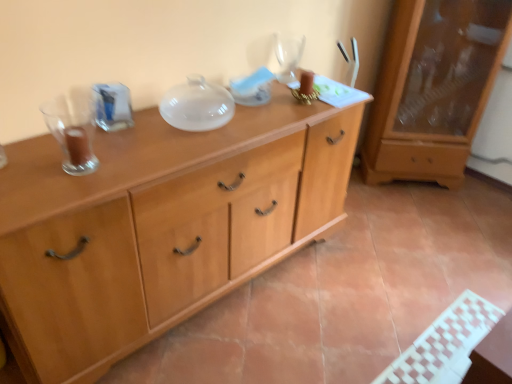
Question: Is light wood cabinet at center a part of transparent glass wine glass at upper center?

Choices:
 (A) yes
 (B) no

Answer: (B)

Question: Is transparent glass wine glass at upper center shorter than light wood cabinet at center?

Choices:
 (A) yes
 (B) no

Answer: (A)

Question: Can you confirm if transparent glass wine glass at upper center is taller than light wood cabinet at center?

Choices:
 (A) yes
 (B) no

Answer: (B)

Question: Is transparent glass wine glass at upper center oriented towards light wood cabinet at center?

Choices:
 (A) no
 (B) yes

Answer: (A)

Question: Is transparent glass wine glass at upper center with light wood cabinet at center?

Choices:
 (A) yes
 (B) no

Answer: (B)

Question: Considering the positions of point (420, 11) and point (24, 145), is point (420, 11) closer or farther from the camera than point (24, 145)?

Choices:
 (A) farther
 (B) closer

Answer: (A)

Question: Looking at their shapes, would you say matte wooden cabinet at right is wider or thinner than light wood cabinet at center?

Choices:
 (A) wide
 (B) thin

Answer: (B)

Question: In terms of height, does matte wooden cabinet at right look taller or shorter compared to light wood cabinet at center?

Choices:
 (A) short
 (B) tall

Answer: (B)

Question: Considering the relative positions of matte wooden cabinet at right and light wood cabinet at center in the image provided, is matte wooden cabinet at right to the left or to the right of light wood cabinet at center?

Choices:
 (A) left
 (B) right

Answer: (B)

Question: Would you say light wood cabinet at center is to the left or to the right of matte wooden cabinet at right in the picture?

Choices:
 (A) left
 (B) right

Answer: (A)

Question: Is light wood cabinet at center situated inside matte wooden cabinet at right or outside?

Choices:
 (A) outside
 (B) inside

Answer: (A)

Question: Considering the positions of light wood cabinet at center and matte wooden cabinet at right in the image, is light wood cabinet at center bigger or smaller than matte wooden cabinet at right?

Choices:
 (A) small
 (B) big

Answer: (B)

Question: Is light wood cabinet at center taller or shorter than matte wooden cabinet at right?

Choices:
 (A) short
 (B) tall

Answer: (A)

Question: In terms of height, does light wood cabinet at center look taller or shorter compared to transparent glass wine glass at upper center?

Choices:
 (A) tall
 (B) short

Answer: (A)

Question: Is light wood cabinet at center inside the boundaries of transparent glass wine glass at upper center, or outside?

Choices:
 (A) outside
 (B) inside

Answer: (A)